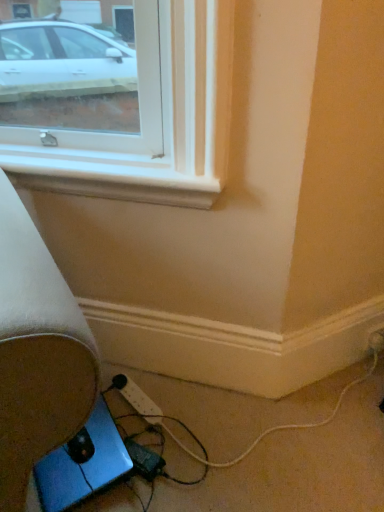
Find the location of a particular element. This screenshot has width=384, height=512. black plastic extension cord at lower center, which is counted as the 1th extension cord, starting from the front is located at coordinates (144, 459).

Find the location of `white plastic power strip at lower right`. white plastic power strip at lower right is located at coordinates (376, 341).

Is point (130, 453) farther from viewer compared to point (380, 350)?

No.

Does black plastic extension cord at lower center, which appears as the 2th extension cord when viewed from the back, have a lesser width compared to white plastic power strip at lower right?

In fact, black plastic extension cord at lower center, which appears as the 2th extension cord when viewed from the back, might be wider than white plastic power strip at lower right.

Who is taller, black plastic extension cord at lower center, which is counted as the 1th extension cord, starting from the front, or white plastic power strip at lower right?

With more height is white plastic power strip at lower right.

Is black plastic extension cord at lower center, which is counted as the 1th extension cord, starting from the front, facing away from white plastic power strip at lower right?

No, white plastic power strip at lower right is not at the back of black plastic extension cord at lower center, which is counted as the 1th extension cord, starting from the front.

Considering the sizes of blue metallic laptop at lower left and white plastic power strip at lower center, the second extension cord positioned from the front, in the image, is blue metallic laptop at lower left bigger or smaller than white plastic power strip at lower center, the second extension cord positioned from the front,?

In the image, blue metallic laptop at lower left appears to be larger than white plastic power strip at lower center, the second extension cord positioned from the front.

How much distance is there between blue metallic laptop at lower left and white plastic power strip at lower center, the 1th extension cord from the back?

blue metallic laptop at lower left and white plastic power strip at lower center, the 1th extension cord from the back, are 8.25 inches apart.

Based on the photo, are blue metallic laptop at lower left and white plastic power strip at lower center, the second extension cord positioned from the front, far apart?

No, blue metallic laptop at lower left is not far away from white plastic power strip at lower center, the second extension cord positioned from the front.

Could you tell me if blue metallic laptop at lower left is turned towards white plastic power strip at lower center, the second extension cord positioned from the front?

No, blue metallic laptop at lower left is not aimed at white plastic power strip at lower center, the second extension cord positioned from the front.

How distant is white plastic power strip at lower center, the 1th extension cord from the back, from white plastic power strip at lower right?

white plastic power strip at lower center, the 1th extension cord from the back, and white plastic power strip at lower right are 32.13 inches apart from each other.

Is point (130, 402) more distant than point (381, 342)?

No, it is in front of (381, 342).

From the image's perspective, is white plastic power strip at lower center, the 1th extension cord from the back, below white plastic power strip at lower right?

Correct, white plastic power strip at lower center, the 1th extension cord from the back, appears lower than white plastic power strip at lower right in the image.

Which object is positioned more to the right, white plastic power strip at lower center, the 1th extension cord from the back, or white plastic power strip at lower right?

white plastic power strip at lower right.

Which of these two, blue metallic laptop at lower left or black plastic extension cord at lower center, which appears as the 2th extension cord when viewed from the back, is smaller?

Smaller between the two is black plastic extension cord at lower center, which appears as the 2th extension cord when viewed from the back.

Measure the distance between blue metallic laptop at lower left and black plastic extension cord at lower center, which appears as the 2th extension cord when viewed from the back.

A distance of 11.72 centimeters exists between blue metallic laptop at lower left and black plastic extension cord at lower center, which appears as the 2th extension cord when viewed from the back.

Which object is further away from the camera, blue metallic laptop at lower left or black plastic extension cord at lower center, which appears as the 2th extension cord when viewed from the back?

black plastic extension cord at lower center, which appears as the 2th extension cord when viewed from the back, is behind.

Which of these two, blue metallic laptop at lower left or black plastic extension cord at lower center, which is counted as the 1th extension cord, starting from the front, is thinner?

Thinner between the two is black plastic extension cord at lower center, which is counted as the 1th extension cord, starting from the front.

Looking at their sizes, would you say white plastic power strip at lower right is wider or thinner than white plastic power strip at lower center, the second extension cord positioned from the front?

Considering their sizes, white plastic power strip at lower right looks slimmer than white plastic power strip at lower center, the second extension cord positioned from the front.

From the image's perspective, between white plastic power strip at lower right and white plastic power strip at lower center, the second extension cord positioned from the front, which one is located above?

From the image's view, white plastic power strip at lower right is above.

Is white plastic power strip at lower right facing away from white plastic power strip at lower center, the second extension cord positioned from the front?

No.

Is white plastic power strip at lower right at the left side of white plastic power strip at lower center, the second extension cord positioned from the front?

No, white plastic power strip at lower right is not to the left of white plastic power strip at lower center, the second extension cord positioned from the front.

Is blue metallic laptop at lower left at the back of white plastic power strip at lower right?

That's not correct — white plastic power strip at lower right is not looking away from blue metallic laptop at lower left.

Can you confirm if white plastic power strip at lower right is thinner than blue metallic laptop at lower left?

Indeed, white plastic power strip at lower right has a lesser width compared to blue metallic laptop at lower left.

At what (x,y) coordinates should I click in order to perform the action: click on electric outlet above the blue metallic laptop at lower left (from a real-world perspective). Please return your answer as a coordinate pair (x, y). Looking at the image, I should click on (376, 341).

Is white plastic power strip at lower right spatially inside blue metallic laptop at lower left, or outside of it?

white plastic power strip at lower right is outside blue metallic laptop at lower left.

At what (x,y) coordinates should I click in order to perform the action: click on extension cord below the white plastic power strip at lower center, the 1th extension cord from the back (from the image's perspective). Please return your answer as a coordinate pair (x, y). Looking at the image, I should click on (144, 459).

Is black plastic extension cord at lower center, which is counted as the 1th extension cord, starting from the front, behind white plastic power strip at lower center, the second extension cord positioned from the front?

No, it is not.

Could you measure the distance between black plastic extension cord at lower center, which appears as the 2th extension cord when viewed from the back, and white plastic power strip at lower center, the second extension cord positioned from the front?

black plastic extension cord at lower center, which appears as the 2th extension cord when viewed from the back, is 5.90 inches from white plastic power strip at lower center, the second extension cord positioned from the front.

Is point (137, 449) closer or farther from the camera than point (128, 381)?

Point (137, 449) is positioned closer to the camera compared to point (128, 381).

The image size is (384, 512). Find the location of `electric outlet on the right of black plastic extension cord at lower center, which appears as the 2th extension cord when viewed from the back`. electric outlet on the right of black plastic extension cord at lower center, which appears as the 2th extension cord when viewed from the back is located at coordinates (376, 341).

The image size is (384, 512). I want to click on gadget to the left of white plastic power strip at lower center, the 1th extension cord from the back, so click(x=83, y=465).

Considering their positions, is black plastic extension cord at lower center, which is counted as the 1th extension cord, starting from the front, positioned closer to white plastic power strip at lower center, the 1th extension cord from the back, than blue metallic laptop at lower left?

Based on the image, black plastic extension cord at lower center, which is counted as the 1th extension cord, starting from the front, appears to be nearer to white plastic power strip at lower center, the 1th extension cord from the back.

Considering their positions, is white plastic power strip at lower right positioned further to black plastic extension cord at lower center, which appears as the 2th extension cord when viewed from the back, than white plastic power strip at lower center, the second extension cord positioned from the front?

white plastic power strip at lower right.

From the image, which object appears to be farther from black plastic extension cord at lower center, which appears as the 2th extension cord when viewed from the back, blue metallic laptop at lower left or white plastic power strip at lower right?

white plastic power strip at lower right is positioned further to the anchor black plastic extension cord at lower center, which appears as the 2th extension cord when viewed from the back.

Which object lies further to the anchor point blue metallic laptop at lower left, white plastic power strip at lower center, the second extension cord positioned from the front, or white plastic power strip at lower right?

white plastic power strip at lower right is further to blue metallic laptop at lower left.

Based on the photo, estimate the real-world distances between objects in this image. Which object is closer to white plastic power strip at lower right, blue metallic laptop at lower left or black plastic extension cord at lower center, which is counted as the 1th extension cord, starting from the front?

black plastic extension cord at lower center, which is counted as the 1th extension cord, starting from the front, is positioned closer to the anchor white plastic power strip at lower right.

Looking at the image, which one is located further to blue metallic laptop at lower left, white plastic power strip at lower right or black plastic extension cord at lower center, which is counted as the 1th extension cord, starting from the front?

The object further to blue metallic laptop at lower left is white plastic power strip at lower right.

When comparing their distances from blue metallic laptop at lower left, does black plastic extension cord at lower center, which appears as the 2th extension cord when viewed from the back, or white plastic power strip at lower right seem further?

white plastic power strip at lower right is further to blue metallic laptop at lower left.

Considering their positions, is white plastic power strip at lower right positioned further to white plastic power strip at lower center, the 1th extension cord from the back, than black plastic extension cord at lower center, which appears as the 2th extension cord when viewed from the back?

white plastic power strip at lower right lies further to white plastic power strip at lower center, the 1th extension cord from the back, than the other object.

The image size is (384, 512). In order to click on extension cord between white plastic power strip at lower center, the second extension cord positioned from the front, and white plastic power strip at lower right from left to right in this screenshot , I will do `click(144, 459)`.

Find the location of a particular element. extension cord located between blue metallic laptop at lower left and white plastic power strip at lower center, the 1th extension cord from the back, in the depth direction is located at coordinates tap(144, 459).